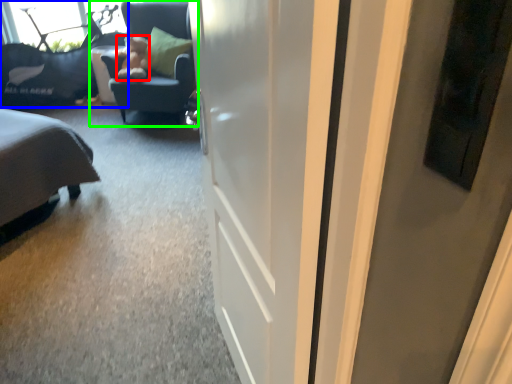
Question: Estimate the real-world distances between objects in this image. Which object is farther from teddy (highlighted by a red box), furniture (highlighted by a blue box) or chair (highlighted by a green box)?

Choices:
 (A) furniture
 (B) chair

Answer: (A)